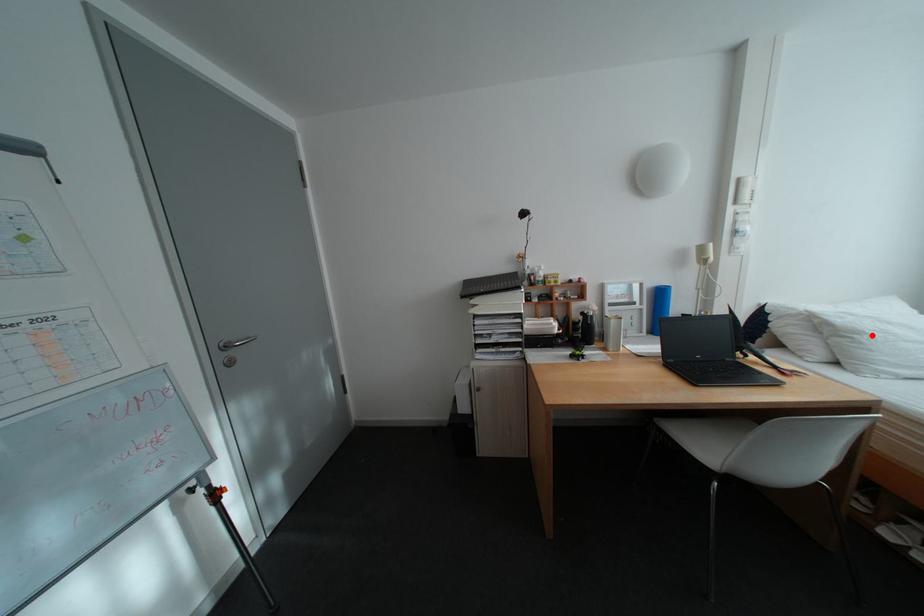
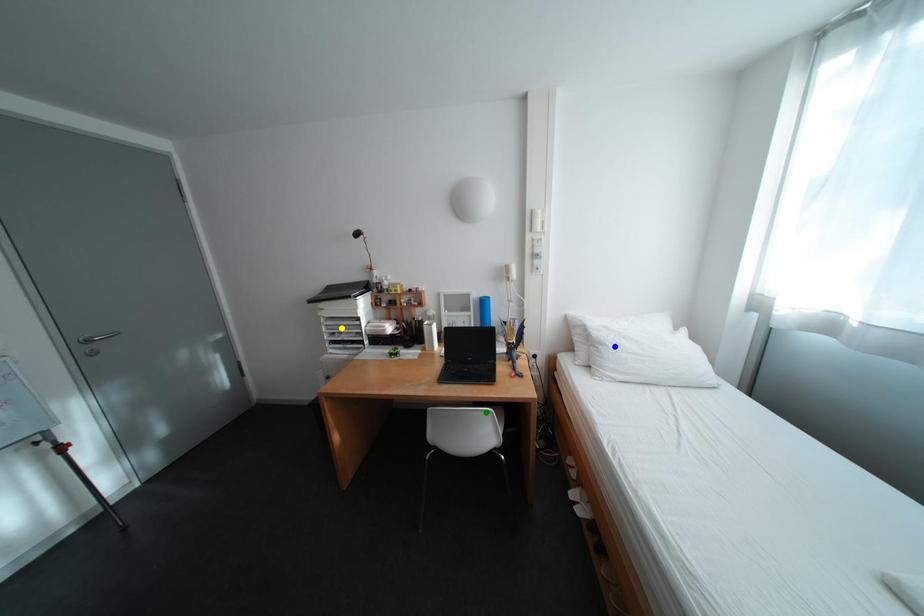
Question: I am providing you with two images of the same scene from different viewpoints. A red point is marked on the first image. You are given multiple points on the second image. Which spot in image 2 lines up with the point in image 1?

Choices:
 (A) blue point
 (B) green point
 (C) yellow point

Answer: (A)